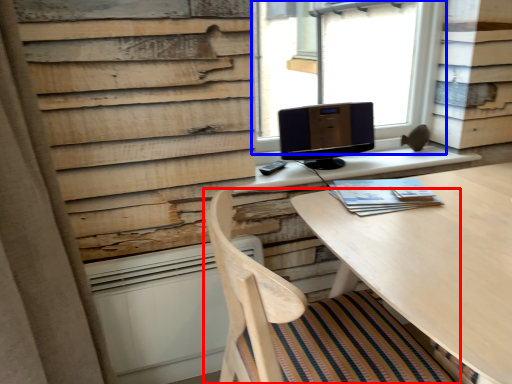
Question: Which point is closer to the camera, chair (highlighted by a red box) or window (highlighted by a blue box)?

Choices:
 (A) chair
 (B) window

Answer: (A)